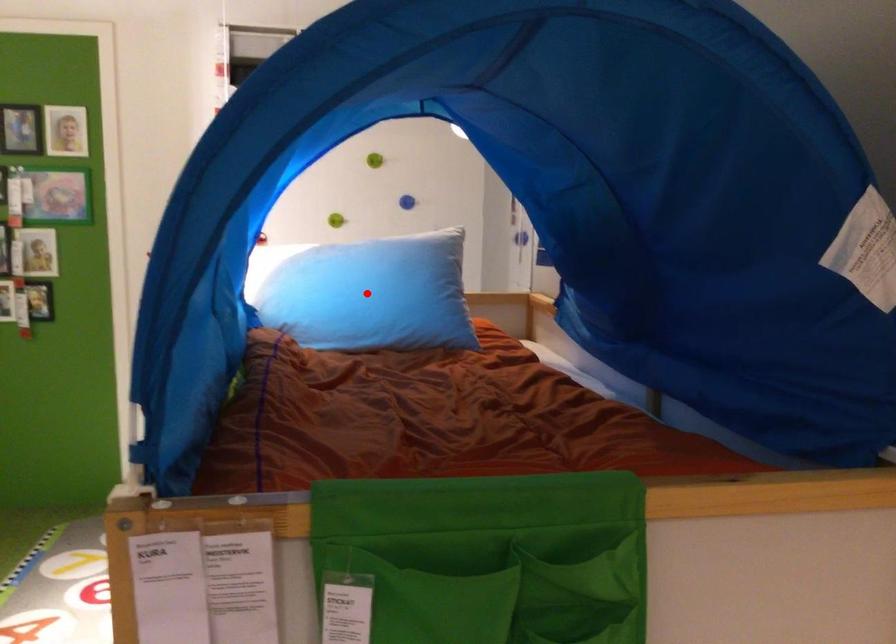
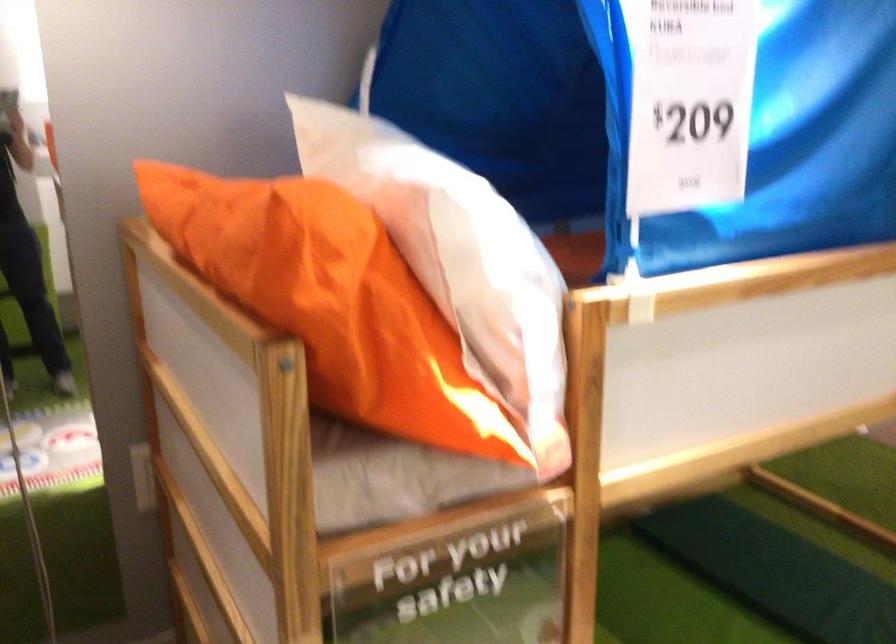
Question: I am providing you with two images of the same scene from different viewpoints. A red point is marked on the first image. Can you still see the location of the red point in image 2?

Choices:
 (A) Yes
 (B) No

Answer: (B)